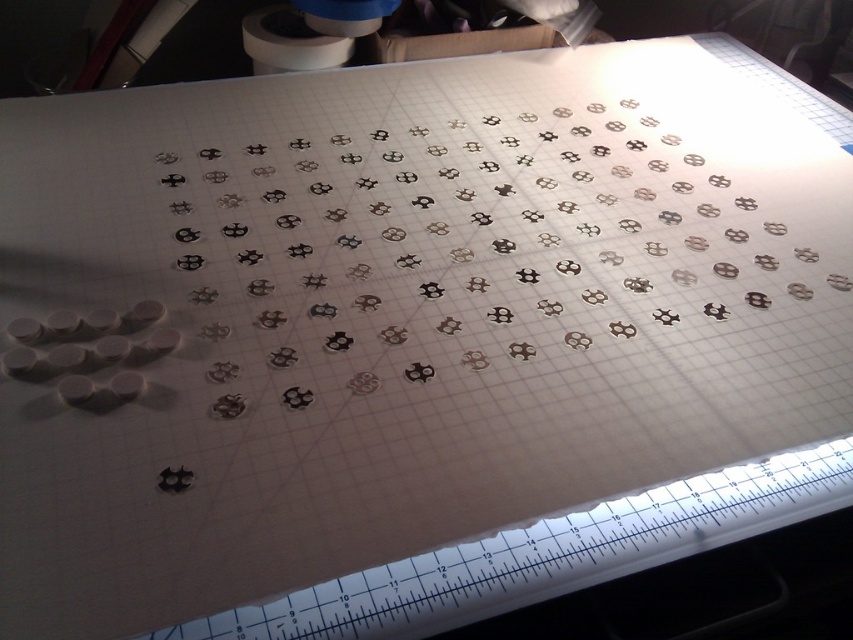
Question: Is white plastic ruler at bottom to the right of white matte toilet paper at upper center from the viewer's perspective?

Choices:
 (A) no
 (B) yes

Answer: (B)

Question: Among these points, which one is nearest to the camera?

Choices:
 (A) (726, 492)
 (B) (305, 36)

Answer: (A)

Question: From the image, what is the correct spatial relationship of white plastic ruler at bottom in relation to white matte toilet paper at upper center?

Choices:
 (A) above
 (B) below

Answer: (B)

Question: Which point is farther to the camera?

Choices:
 (A) white plastic ruler at bottom
 (B) white matte toilet paper at upper center

Answer: (B)

Question: Is white plastic ruler at bottom to the right of white matte toilet paper at upper center from the viewer's perspective?

Choices:
 (A) yes
 (B) no

Answer: (A)